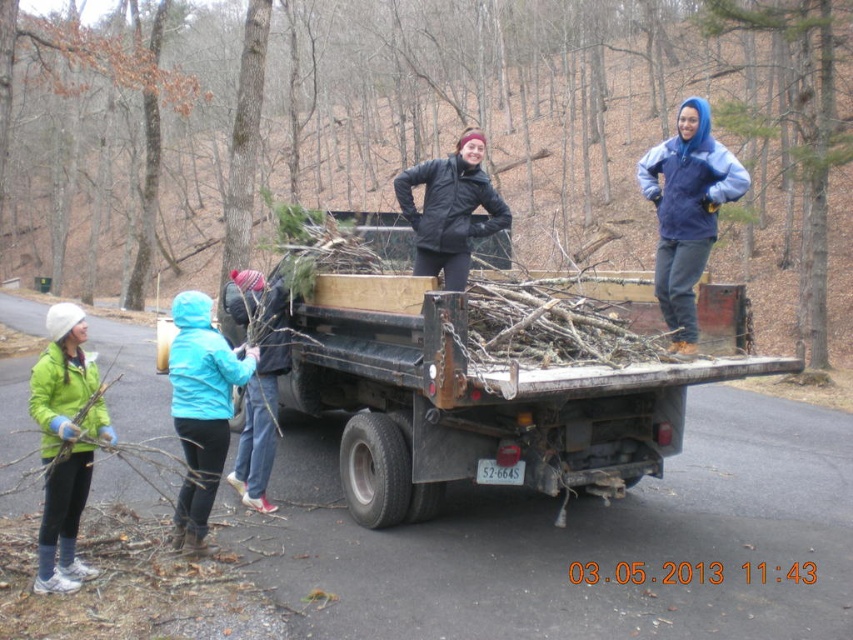
You are a volunteer at the cleanup site and need to locate the person wearing the green matte jacket at left. Based on the scene, where should you look relative to the black matte jacket at center?

The green matte jacket at left is positioned to the left of the black matte jacket at center, so you should look to the left side of the black matte jacket at center to find the volunteer.

You are a photographer trying to capture a photo of the rusty metal truck at center and the black matte jacket at center. Since you want to emphasize the size difference between them, which object should you focus on to make the truck look bigger than the jacket?

The rusty metal truck at center is larger in size than the black matte jacket at center, so focusing on the truck will naturally emphasize its larger size compared to the jacket.